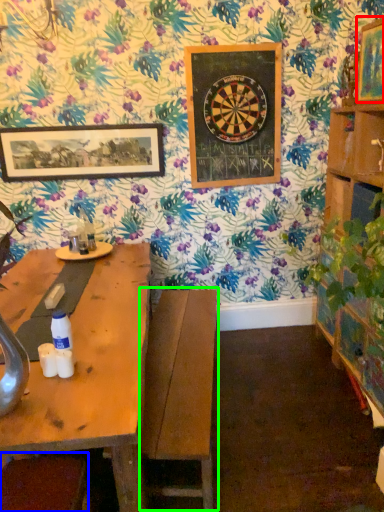
Question: Estimate the real-world distances between objects in this image. Which object is closer to picture frame (highlighted by a red box), swivel chair (highlighted by a blue box) or swivel chair (highlighted by a green box)?

Choices:
 (A) swivel chair
 (B) swivel chair

Answer: (B)